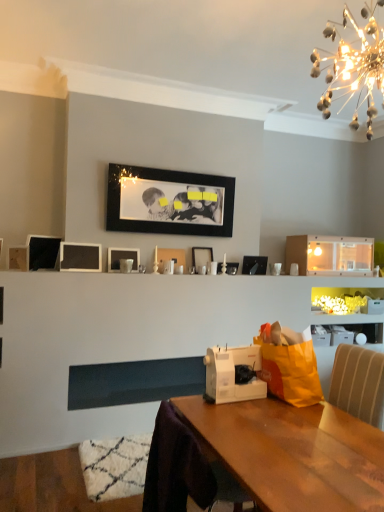
Question: Is point (54, 253) closer or farther from the camera than point (297, 393)?

Choices:
 (A) farther
 (B) closer

Answer: (A)

Question: From the image's perspective, is matte black picture frame at upper left, the 1th picture frame when ordered from left to right, positioned above or below orange fabric shopping bag at right?

Choices:
 (A) below
 (B) above

Answer: (B)

Question: Estimate the real-world distances between objects in this image. Which object is closer to the metallic silver picture frame at center, which ranks as the second picture frame in right-to-left order?

Choices:
 (A) white glossy cabinet at upper center
 (B) matte black picture frame at center, which ranks as the 3th picture frame in right-to-left order
 (C) brown fabric swivel chair at lower right
 (D) metallic silver picture frame at center, which ranks as the 8th picture frame in left-to-right order
 (E) orange fabric shopping bag at right

Answer: (D)

Question: Based on their relative distances, which object is nearer to the white glossy picture frame at center, which is the fourth picture frame in left-to-right order?

Choices:
 (A) metallic silver picture frame at center, which ranks as the second picture frame in right-to-left order
 (B) brown fabric swivel chair at lower right
 (C) illuminated glass chandelier at upper right
 (D) orange fabric shopping bag at right
 (E) black matte picture frame at upper center, the 5th picture frame viewed from the left

Answer: (E)